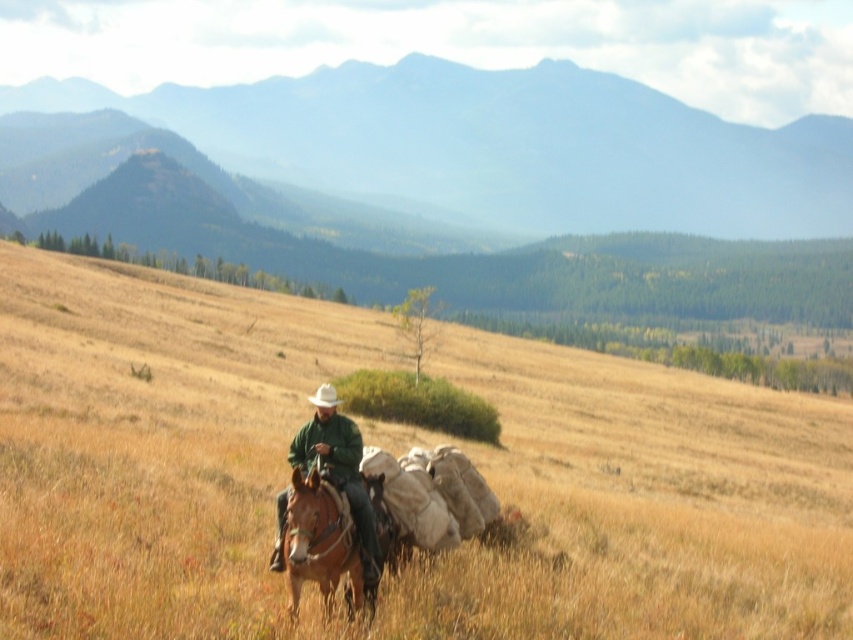
You are a photographer standing at the edge of the field. You want to take a photo that includes both the dry grass at center and the brown leather horse at center. Based on their positions, which object should you adjust your camera angle to focus on first to ensure both are in frame?

The dry grass at center is positioned on the right side of brown leather horse at center, so you should adjust your camera angle to focus on the brown leather horse at center first to ensure both are in frame.

You are a photographer planning to capture the scene with a wide angle lens. You want to ensure that both the dry grass at center and the green matte jacket at center are clearly visible. Considering their sizes, which object will occupy more space in your photo?

The dry grass at center is larger in size than the green matte jacket at center, so it will occupy more space in the photo.

You are standing at the origin point in the image. Which direction should you move to reach the dry grass at center?

The dry grass at center is located at point (x=149, y=444), so you should move towards the right and slightly forward to reach it.